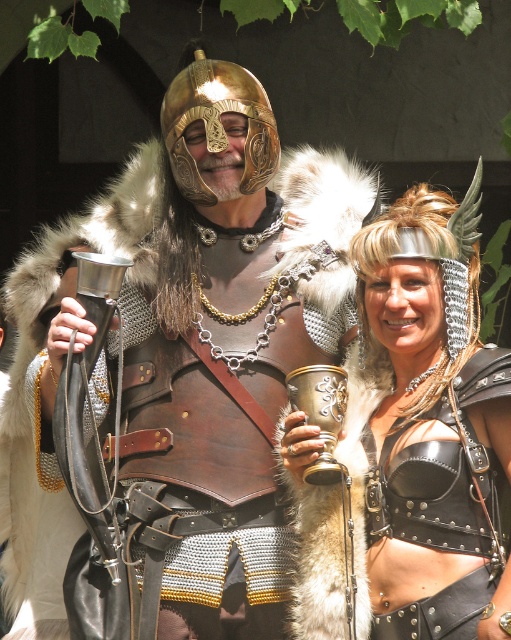
You are a medieval merchant who needs to transport both the polished brass helmet at center and the shiny gold cup at center in a box that can only hold items up to the size of the helmet. Can you fit both items in the box?

The polished brass helmet at center has a larger size compared to the shiny gold cup at center. Since the box can hold items up to the size of the helmet, both items can fit inside the box as the cup is smaller than the helmet.

You are standing at the origin point in the image and want to move towards the two points labeled point (18,628) and point (474,582). Which point will you encounter first as you move forward?

Point (474,582) will be encountered first because it is in front of point (18,628) according to their spatial relationship.

You are a guest at a medieval banquet and notice two items on the table in front of you. There is a polished brass helmet at center and a shiny gold cup at center. Which item is closer to you?

The polished brass helmet at center is closer to you because the shiny gold cup at center is behind it.